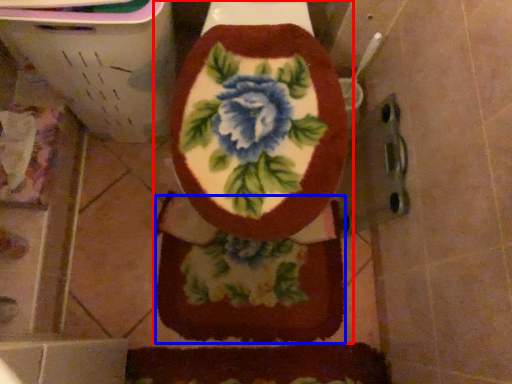
Question: Which object appears closest to the camera in this image, toilet (highlighted by a red box) or blanket (highlighted by a blue box)?

Choices:
 (A) toilet
 (B) blanket

Answer: (A)